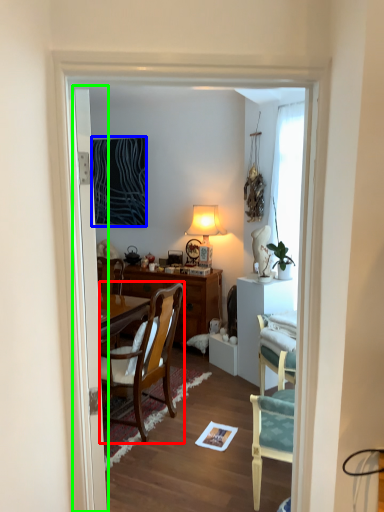
Question: Based on their relative distances, which object is farther from chair (highlighted by a red box)? Choose from picture frame (highlighted by a blue box) and door (highlighted by a green box).

Choices:
 (A) picture frame
 (B) door

Answer: (A)